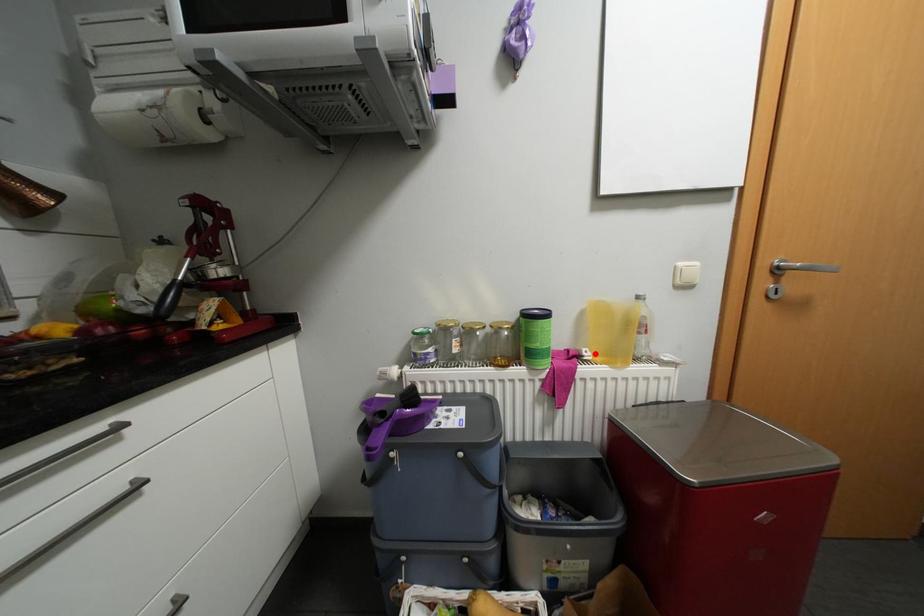
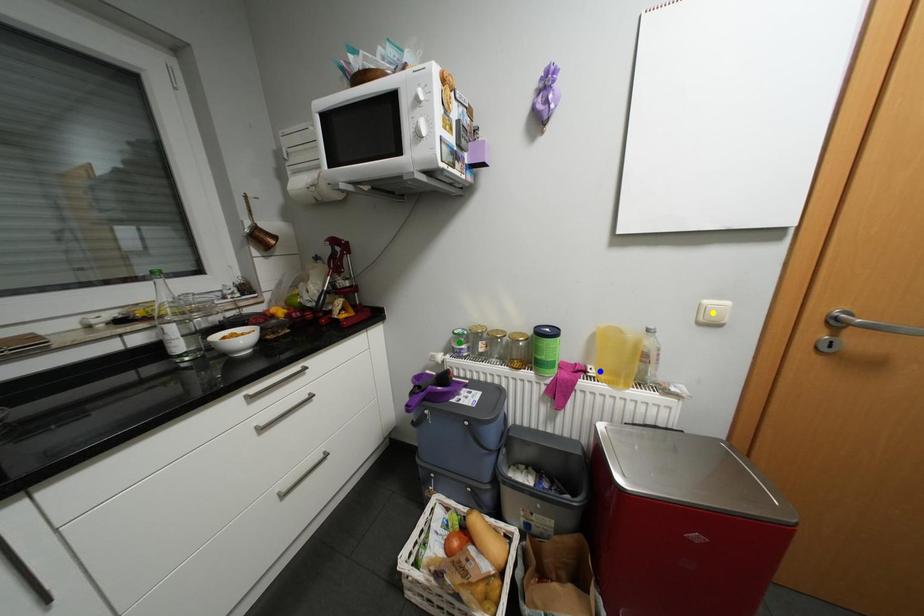
Question: I am providing you with two images of the same scene from different viewpoints. A red point is marked on the first image. You are given multiple points on the second image. In image 2, which mark is for the same physical point as the one in image 1?

Choices:
 (A) yellow point
 (B) blue point
 (C) green point

Answer: (B)